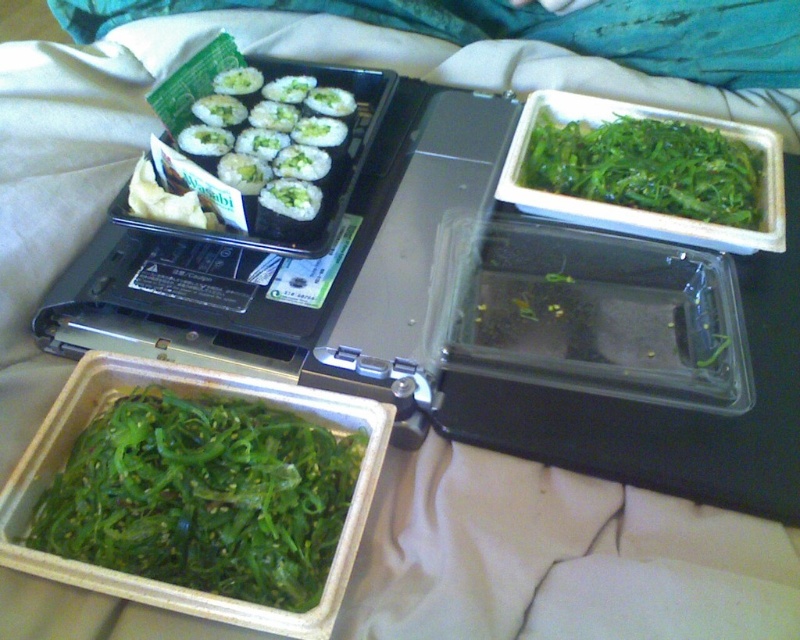
Question: Among these points, which one is nearest to the camera?

Choices:
 (A) (314, 134)
 (B) (52, 529)

Answer: (B)

Question: Can you confirm if green leafy seaweed at lower left is wider than green leafy vegetable at upper right?

Choices:
 (A) yes
 (B) no

Answer: (B)

Question: Considering the relative positions of green leafy seaweed at lower left and white rice with green topping at upper left in the image provided, where is green leafy seaweed at lower left located with respect to white rice with green topping at upper left?

Choices:
 (A) left
 (B) right

Answer: (A)

Question: Is green leafy seaweed at lower left above green leafy vegetable at upper right?

Choices:
 (A) yes
 (B) no

Answer: (B)

Question: Which of the following is the farthest from the observer?

Choices:
 (A) (298, 196)
 (B) (350, 438)

Answer: (A)

Question: Based on their relative distances, which object is farther from the green leafy seaweed at lower left?

Choices:
 (A) green leafy vegetable at upper right
 (B) white rice with green topping at upper left

Answer: (A)